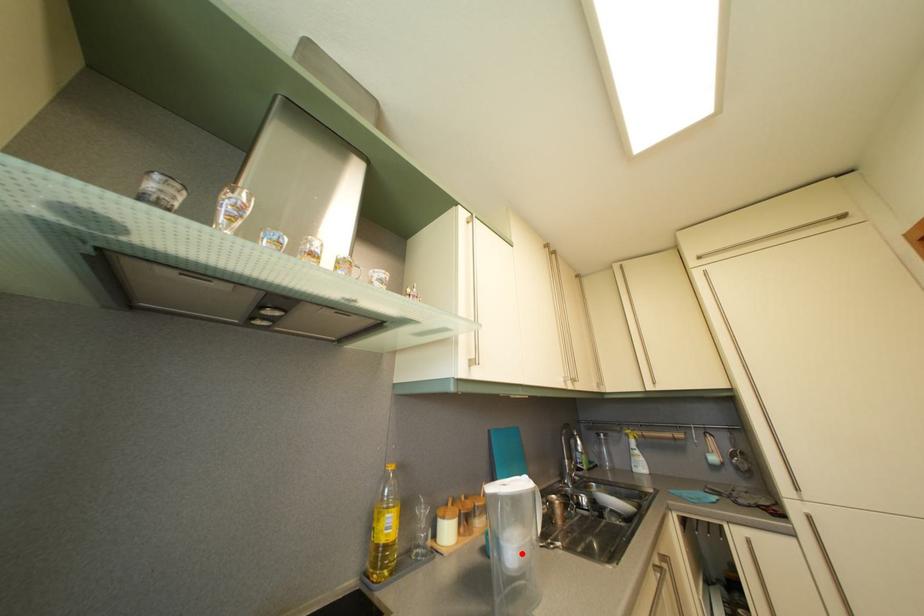
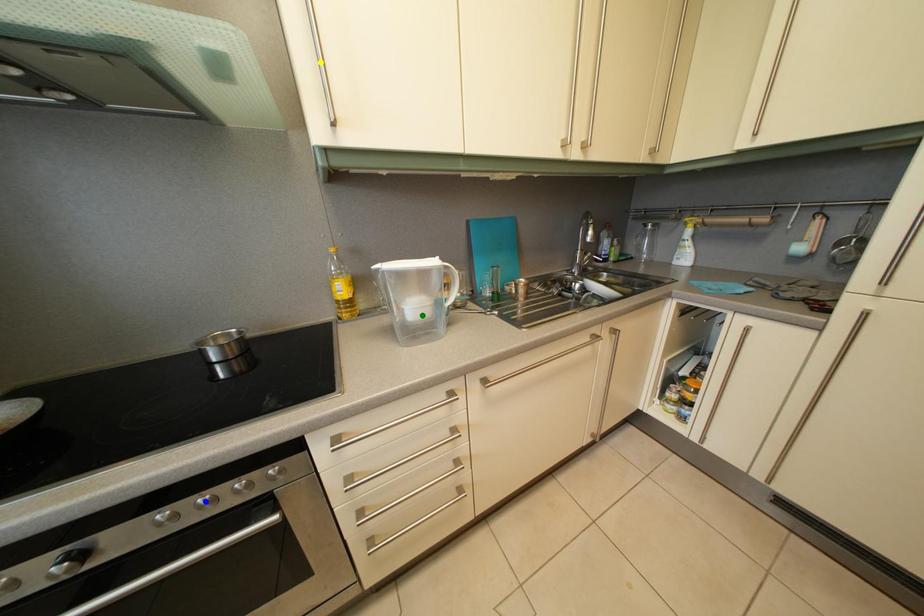
Question: I am providing you with two images of the same scene from different viewpoints. A red point is marked on the first image. You are given multiple points on the second image. Which spot in image 2 lines up with the point in image 1?

Choices:
 (A) green point
 (B) blue point
 (C) yellow point

Answer: (A)